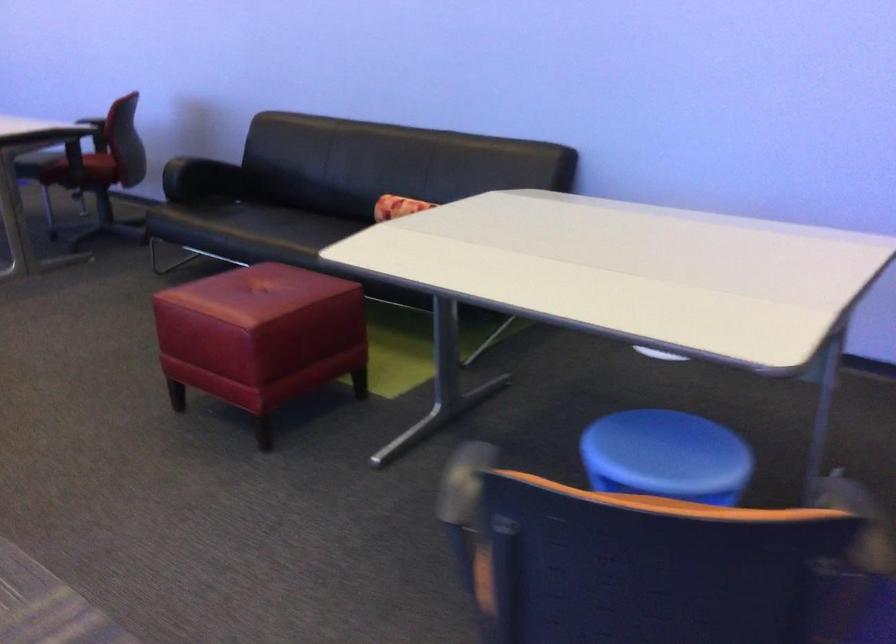
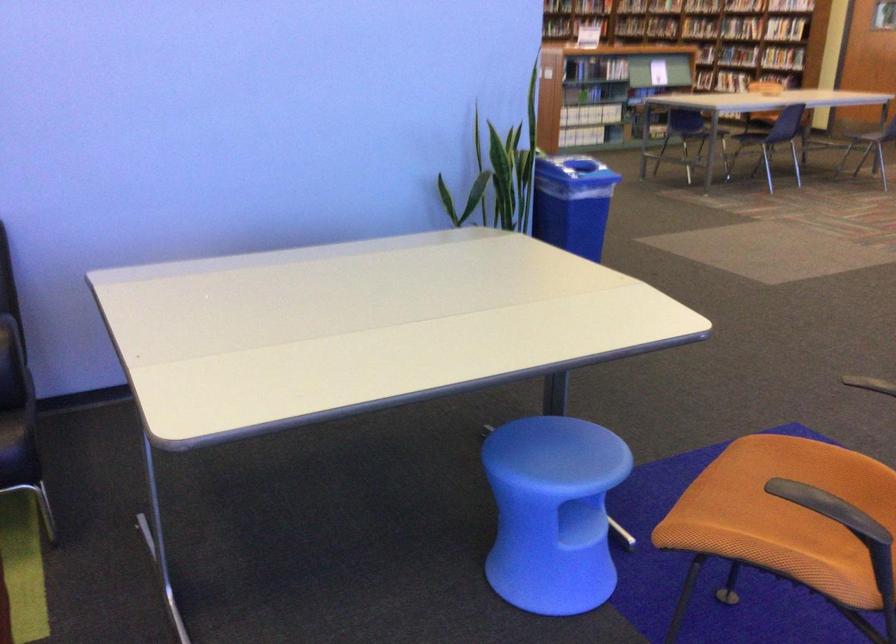
Find the pixel in the second image that matches point 660,451 in the first image.

(560, 453)